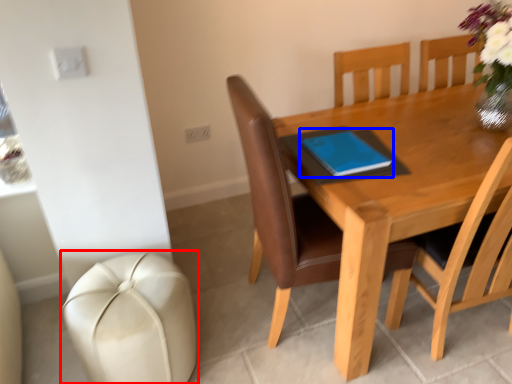
Question: Which object appears closest to the camera in this image, swivel chair (highlighted by a red box) or notebook (highlighted by a blue box)?

Choices:
 (A) swivel chair
 (B) notebook

Answer: (A)